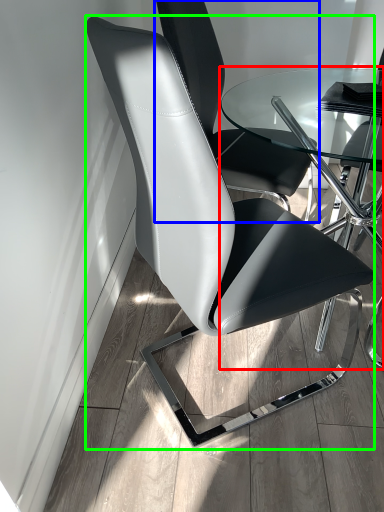
Question: Estimate the real-world distances between objects in this image. Which object is closer to table (highlighted by a red box), chair (highlighted by a blue box) or chair (highlighted by a green box)?

Choices:
 (A) chair
 (B) chair

Answer: (A)